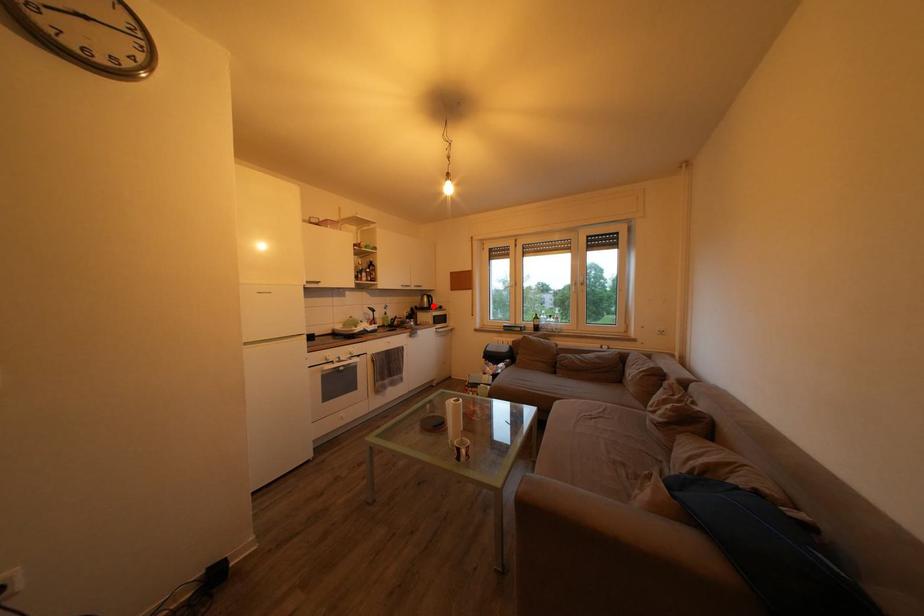
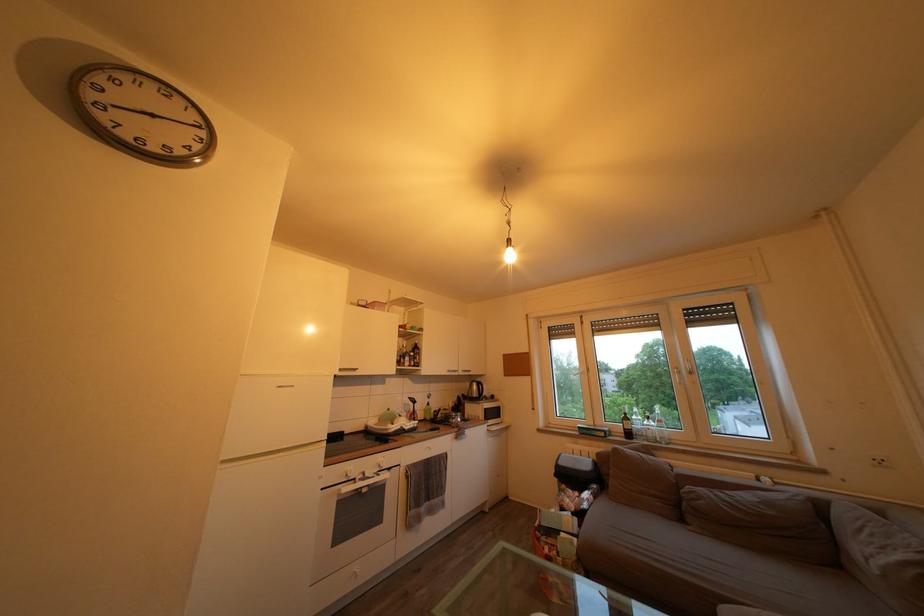
Question: I am providing you with two images of the same scene from different viewpoints. A red point is shown in image1. For the corresponding object point in image2, is it positioned nearer or farther from the camera?

Choices:
 (A) Nearer
 (B) Farther

Answer: (B)